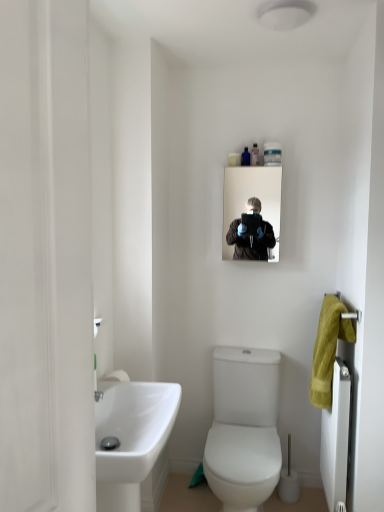
The height and width of the screenshot is (512, 384). What are the coordinates of `white matte screen door at left` in the screenshot? It's located at (45, 258).

Describe the element at coordinates (245, 157) in the screenshot. I see `translucent plastic bottle at upper center, positioned as the second toiletry in left-to-right order` at that location.

In order to face white textured radiator at right, should I rotate leftwards or rightwards?

It's best to rotate right around 18.541 degrees.

What do you see at coordinates (251, 196) in the screenshot? I see `matte black mirror at upper center` at bounding box center [251, 196].

The width and height of the screenshot is (384, 512). Describe the element at coordinates (131, 439) in the screenshot. I see `white glossy sink at lower left` at that location.

How much space does translucent plastic bottle at upper center, which is counted as the 3th toiletry, starting from the left, occupy vertically?

translucent plastic bottle at upper center, which is counted as the 3th toiletry, starting from the left, is 5.16 inches in height.

In order to click on white matte screen door at left in this screenshot , I will do `click(45, 258)`.

Does white matte screen door at left come behind white textured radiator at right?

No, the depth of white matte screen door at left is less than that of white textured radiator at right.

Between white matte screen door at left and white textured radiator at right, which one appears on the right side from the viewer's perspective?

Positioned to the right is white textured radiator at right.

From the image's perspective, would you say white matte screen door at left is positioned over white textured radiator at right?

Correct, white matte screen door at left appears higher than white textured radiator at right in the image.

Is matte black mirror at upper center inside the boundaries of translucent plastic bottle at upper center, positioned as the second toiletry in left-to-right order, or outside?

matte black mirror at upper center is located beyond the bounds of translucent plastic bottle at upper center, positioned as the second toiletry in left-to-right order.

Which object is further away from the camera taking this photo, matte black mirror at upper center or translucent plastic bottle at upper center, which ranks as the second toiletry in right-to-left order?

translucent plastic bottle at upper center, which ranks as the second toiletry in right-to-left order, is further from the camera.

Is translucent plastic bottle at upper center, positioned as the second toiletry in left-to-right order, at the back of matte black mirror at upper center?

No, translucent plastic bottle at upper center, positioned as the second toiletry in left-to-right order, is not at the back of matte black mirror at upper center.

Which is behind, white textured radiator at right or white glossy sink at lower left?

white textured radiator at right is more distant.

Based on the photo, who is shorter, white textured radiator at right or white glossy sink at lower left?

With less height is white glossy sink at lower left.

Does white textured radiator at right have a larger size compared to white glossy sink at lower left?

No, white textured radiator at right is not bigger than white glossy sink at lower left.

Considering the relative sizes of matte black mirror at upper center and white glossy sink at lower left in the image provided, is matte black mirror at upper center thinner than white glossy sink at lower left?

Yes, matte black mirror at upper center is thinner than white glossy sink at lower left.

From a real-world perspective, which is physically below, matte black mirror at upper center or white glossy sink at lower left?

white glossy sink at lower left.

Between matte black mirror at upper center and white glossy sink at lower left, which one appears on the left side from the viewer's perspective?

white glossy sink at lower left is more to the left.

Does matte black mirror at upper center have a smaller size compared to white glossy sink at lower left?

Correct, matte black mirror at upper center occupies less space than white glossy sink at lower left.

Looking at this image, is white textured radiator at right not near translucent plastic bottle at upper center, positioned as the second toiletry in left-to-right order?

white textured radiator at right is positioned a significant distance from translucent plastic bottle at upper center, positioned as the second toiletry in left-to-right order.

Looking at the image, does white textured radiator at right seem bigger or smaller compared to translucent plastic bottle at upper center, positioned as the second toiletry in left-to-right order?

Clearly, white textured radiator at right is larger in size than translucent plastic bottle at upper center, positioned as the second toiletry in left-to-right order.

Is white textured radiator at right facing towards translucent plastic bottle at upper center, which ranks as the second toiletry in right-to-left order?

No.

Which of these two, white textured radiator at right or translucent plastic bottle at upper center, positioned as the second toiletry in left-to-right order, is thinner?

translucent plastic bottle at upper center, positioned as the second toiletry in left-to-right order, is thinner.

Is white glossy sink at lower left oriented away from translucent plastic bottle at upper center, the first toiletry from the right?

No, white glossy sink at lower left's orientation is not away from translucent plastic bottle at upper center, the first toiletry from the right.

Is white glossy sink at lower left at the right side of translucent plastic bottle at upper center, the first toiletry from the right?

Incorrect, white glossy sink at lower left is not on the right side of translucent plastic bottle at upper center, the first toiletry from the right.

Does point (104, 437) come in front of point (252, 159)?

Yes, it is.

Is white glossy sink at lower left inside or outside of translucent plastic bottle at upper center, which is counted as the 3th toiletry, starting from the left?

white glossy sink at lower left cannot be found inside translucent plastic bottle at upper center, which is counted as the 3th toiletry, starting from the left.

Which point is more distant from viewer, (247, 164) or (271, 181)?

The point (271, 181) is farther.

From the image's perspective, would you say translucent plastic bottle at upper center, which ranks as the second toiletry in right-to-left order, is shown under matte black mirror at upper center?

No.

Are translucent plastic bottle at upper center, which ranks as the second toiletry in right-to-left order, and matte black mirror at upper center located far from each other?

No, translucent plastic bottle at upper center, which ranks as the second toiletry in right-to-left order, is in close proximity to matte black mirror at upper center.

This screenshot has height=512, width=384. What are the coordinates of `screen door above the white textured radiator at right (from the image's perspective)` in the screenshot? It's located at (45, 258).

The width and height of the screenshot is (384, 512). What are the coordinates of `mirror in front of the translucent plastic bottle at upper center, which ranks as the second toiletry in right-to-left order` in the screenshot? It's located at (251, 196).

Which object lies further to the anchor point translucent plastic bottle at upper center, positioned as the second toiletry in left-to-right order, white glossy toilet at center or white glossy sink at lower left?

Among the two, white glossy sink at lower left is located further to translucent plastic bottle at upper center, positioned as the second toiletry in left-to-right order.

Based on their spatial positions, is white matte screen door at left or translucent plastic bottle at upper center, arranged as the first toiletry when viewed from the left, further from white textured radiator at right?

Based on the image, white matte screen door at left appears to be further to white textured radiator at right.

Which object lies further to the anchor point translucent plastic bottle at upper center, positioned as the second toiletry in left-to-right order, translucent plastic bottle at upper center, arranged as the first toiletry when viewed from the left, or white glossy toilet at center?

Among the two, white glossy toilet at center is located further to translucent plastic bottle at upper center, positioned as the second toiletry in left-to-right order.

Estimate the real-world distances between objects in this image. Which object is further from white textured radiator at right, translucent plastic bottle at upper center, the first toiletry from the right, or translucent plastic bottle at upper center, positioned as the second toiletry in left-to-right order?

translucent plastic bottle at upper center, positioned as the second toiletry in left-to-right order, is further to white textured radiator at right.

Looking at the image, which one is located further to matte black mirror at upper center, white glossy sink at lower left or white matte screen door at left?

white matte screen door at left lies further to matte black mirror at upper center than the other object.

Which object lies further to the anchor point translucent plastic bottle at upper center, the first toiletry from the right, white glossy sink at lower left or translucent plastic bottle at upper center, positioned as the second toiletry in left-to-right order?

white glossy sink at lower left lies further to translucent plastic bottle at upper center, the first toiletry from the right, than the other object.

Looking at the image, which one is located further to white glossy toilet at center, white textured radiator at right or translucent plastic bottle at upper center, which ranks as the second toiletry in right-to-left order?

The object further to white glossy toilet at center is translucent plastic bottle at upper center, which ranks as the second toiletry in right-to-left order.

When comparing their distances from white textured radiator at right, does white matte screen door at left or matte black mirror at upper center seem closer?

The object closer to white textured radiator at right is matte black mirror at upper center.

Identify the location of toilet between white matte screen door at left and translucent plastic bottle at upper center, positioned as the second toiletry in left-to-right order, in the front-back direction. The image size is (384, 512). (244, 428).

Locate an element on the screen. The image size is (384, 512). sink between white matte screen door at left and white glossy toilet at center in the front-back direction is located at coordinates (131, 439).

Where is `mirror between translucent plastic bottle at upper center, which is counted as the 3th toiletry, starting from the left, and white textured radiator at right from top to bottom`? Image resolution: width=384 pixels, height=512 pixels. mirror between translucent plastic bottle at upper center, which is counted as the 3th toiletry, starting from the left, and white textured radiator at right from top to bottom is located at coordinates (251, 196).

Identify the location of toiletry that lies between translucent plastic bottle at upper center, which ranks as the second toiletry in right-to-left order, and white glossy toilet at center from top to bottom. Image resolution: width=384 pixels, height=512 pixels. (234, 159).